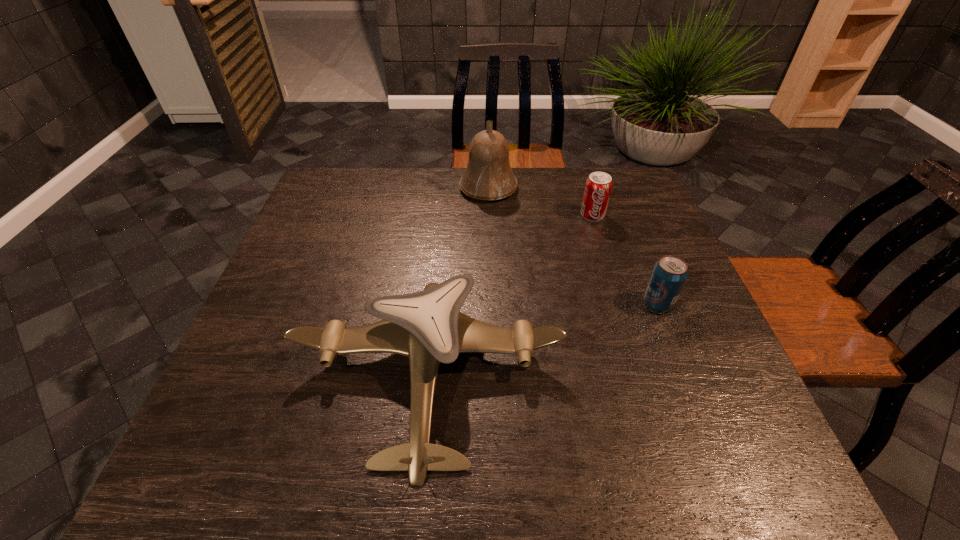
At what (x,y) coordinates should I click in order to perform the action: click on the tallest object. Please return your answer as a coordinate pair (x, y). The height and width of the screenshot is (540, 960). Looking at the image, I should click on (488, 176).

Locate an element on the screen. This screenshot has height=540, width=960. bell is located at coordinates (488, 176).

The height and width of the screenshot is (540, 960). Identify the location of the second object from right to left. (598, 186).

Locate an element on the screen. This screenshot has width=960, height=540. the left pop soda is located at coordinates (598, 186).

Where is `the right pop soda`? the right pop soda is located at coordinates (669, 274).

Locate an element on the screen. This screenshot has height=540, width=960. the rightmost object is located at coordinates (669, 274).

Where is `drone`? drone is located at coordinates point(427,326).

Find the location of `free location located 0.130m on the front of the tallest object`. free location located 0.130m on the front of the tallest object is located at coordinates (490, 232).

Identify the location of blank space located on the left of the second object from right to left. This screenshot has width=960, height=540. (521, 215).

The height and width of the screenshot is (540, 960). I want to click on vacant area located on the left of the rightmost object, so click(509, 303).